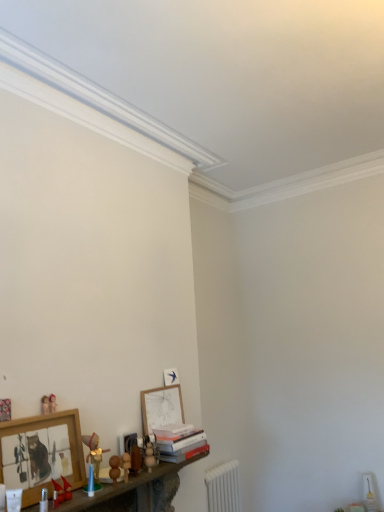
Question: Looking at their shapes, would you say matte wooden toy at lower left, the sixth toy positioned from the right, is wider or thinner than matte red toy boat at lower left, which is the 3th toy from left to right?

Choices:
 (A) thin
 (B) wide

Answer: (A)

Question: From the image's perspective, is matte wooden toy at lower left, the sixth toy positioned from the right, located above or below matte red toy boat at lower left, arranged as the fourth toy when viewed from the right?

Choices:
 (A) below
 (B) above

Answer: (B)

Question: Which object is the farthest from the wooden at lower left?

Choices:
 (A) wooden framed picture at lower left, which ranks as the second picture frame in back-to-front order
 (B) matte wooden figurine at lower left, acting as the fifth toy starting from the right
 (C) hardcover books at lower center
 (D) matte wooden toy at lower left, the sixth toy positioned from the right
 (E) white plastic radiator at lower right

Answer: (E)

Question: Which of these objects is positioned farthest from the matte wooden figurine at lower left, the 2th toy in the left-to-right sequence?

Choices:
 (A) wooden at lower left
 (B) wooden framed picture at lower left, positioned as the first picture frame in front-to-back order
 (C) matte wooden toy at lower left, the sixth toy positioned from the right
 (D) gold metallic figurine at lower left, placed as the 4th toy when sorted from left to right
 (E) hardcover books at lower center

Answer: (E)